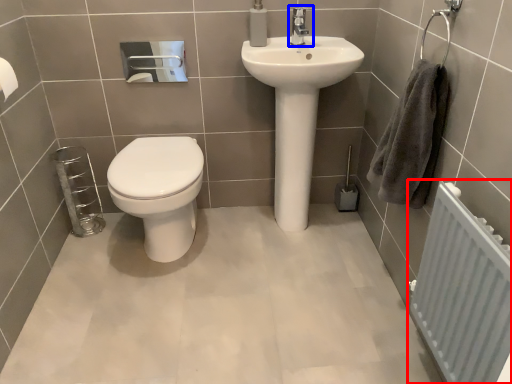
Question: Which of the following is the closest to the observer, radiator (highlighted by a red box) or tap (highlighted by a blue box)?

Choices:
 (A) radiator
 (B) tap

Answer: (A)